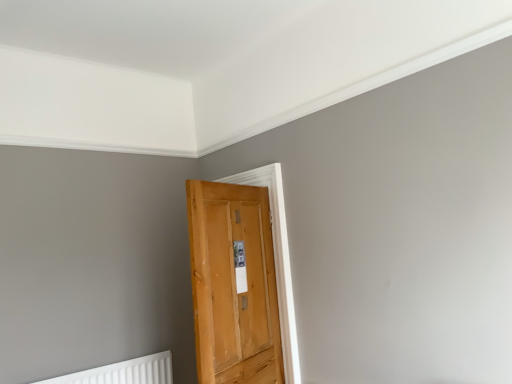
This screenshot has height=384, width=512. What do you see at coordinates (233, 284) in the screenshot?
I see `wooden door at center` at bounding box center [233, 284].

At what (x,y) coordinates should I click in order to perform the action: click on wooden door at center. Please return your answer as a coordinate pair (x, y). The image size is (512, 384). Looking at the image, I should click on (233, 284).

What is the approximate width of wooden door at center?

wooden door at center is 32.04 inches wide.

Describe the element at coordinates (123, 372) in the screenshot. I see `white plastic radiator at lower left` at that location.

You are a GUI agent. You are given a task and a screenshot of the screen. Output one action in this format:
    pyautogui.click(x=<x>, y=<y>)
    Task: Click on the white plastic radiator at lower left
    
    Given the screenshot: What is the action you would take?
    (x=123, y=372)

Locate an element on the screen. The height and width of the screenshot is (384, 512). wooden door at center is located at coordinates (233, 284).

Considering the relative positions of wooden door at center and white plastic radiator at lower left in the image provided, is wooden door at center to the left or to the right of white plastic radiator at lower left?

From the image, it's evident that wooden door at center is to the right of white plastic radiator at lower left.

Is the depth of wooden door at center greater than that of white plastic radiator at lower left?

No.

Is point (217, 218) less distant than point (75, 375)?

Yes.

Based on the photo, from the image's perspective, which one is positioned higher, wooden door at center or white plastic radiator at lower left?

wooden door at center.

From a real-world perspective, between wooden door at center and white plastic radiator at lower left, who is vertically lower?

From a 3D spatial view, white plastic radiator at lower left is below.

Can you confirm if wooden door at center is thinner than white plastic radiator at lower left?

No.

Is wooden door at center taller or shorter than white plastic radiator at lower left?

wooden door at center is taller than white plastic radiator at lower left.

Considering the sizes of objects wooden door at center and white plastic radiator at lower left in the image provided, who is bigger, wooden door at center or white plastic radiator at lower left?

wooden door at center.

In the scene shown: Would you say wooden door at center is outside white plastic radiator at lower left?

Yes.

Is wooden door at center far from white plastic radiator at lower left?

Indeed, wooden door at center is not near white plastic radiator at lower left.

Could you tell me if wooden door at center is turned towards white plastic radiator at lower left?

No, wooden door at center is not turned towards white plastic radiator at lower left.

Locate an element on the screen. The height and width of the screenshot is (384, 512). radiator on the left side of wooden door at center is located at coordinates (123, 372).

Considering the positions of objects white plastic radiator at lower left and wooden door at center in the image provided, who is more to the right, white plastic radiator at lower left or wooden door at center?

wooden door at center is more to the right.

Does white plastic radiator at lower left come in front of wooden door at center?

No, the depth of white plastic radiator at lower left is greater than that of wooden door at center.

Between point (153, 361) and point (249, 343), which one is positioned in front?

The point (249, 343) is closer.

From the image's perspective, which one is positioned higher, white plastic radiator at lower left or wooden door at center?

wooden door at center appears higher in the image.

From a real-world perspective, is white plastic radiator at lower left positioned over wooden door at center based on gravity?

Incorrect, from a real-world perspective, white plastic radiator at lower left is lower than wooden door at center.

Considering the sizes of objects white plastic radiator at lower left and wooden door at center in the image provided, who is wider, white plastic radiator at lower left or wooden door at center?

Wider between the two is wooden door at center.

Is white plastic radiator at lower left shorter than wooden door at center?

Yes, white plastic radiator at lower left is shorter than wooden door at center.

Which of these two, white plastic radiator at lower left or wooden door at center, is bigger?

wooden door at center is bigger.

Is white plastic radiator at lower left inside or outside of wooden door at center?

white plastic radiator at lower left is located beyond the bounds of wooden door at center.

Are white plastic radiator at lower left and wooden door at center located far from each other?

Absolutely, white plastic radiator at lower left is distant from wooden door at center.

Could you tell me if white plastic radiator at lower left is turned towards wooden door at center?

No, white plastic radiator at lower left is not facing towards wooden door at center.

How much distance is there between white plastic radiator at lower left and wooden door at center?

white plastic radiator at lower left and wooden door at center are 3.84 feet apart from each other.

Locate an element on the screen. radiator on the left of wooden door at center is located at coordinates (123, 372).

Where is `door in front of the white plastic radiator at lower left`? door in front of the white plastic radiator at lower left is located at coordinates (233, 284).

Where is `door above the white plastic radiator at lower left (from the image's perspective)`? Image resolution: width=512 pixels, height=384 pixels. door above the white plastic radiator at lower left (from the image's perspective) is located at coordinates (233, 284).